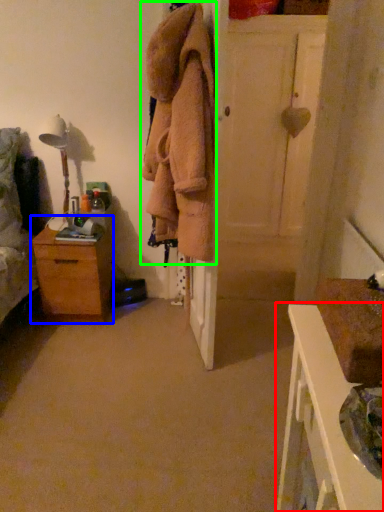
Question: Which is farther away from nightstand (highlighted by a red box)? chest of drawers (highlighted by a blue box) or clothing (highlighted by a green box)?

Choices:
 (A) chest of drawers
 (B) clothing

Answer: (A)